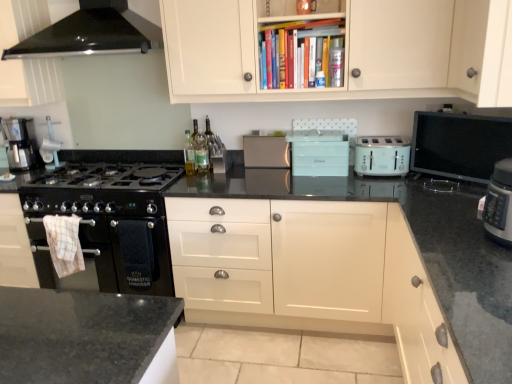
Locate an element on the screen. The image size is (512, 384). free space above mint green plastic toaster at center, which is the second appliance in right-to-left order (from a real-world perspective) is located at coordinates (320, 134).